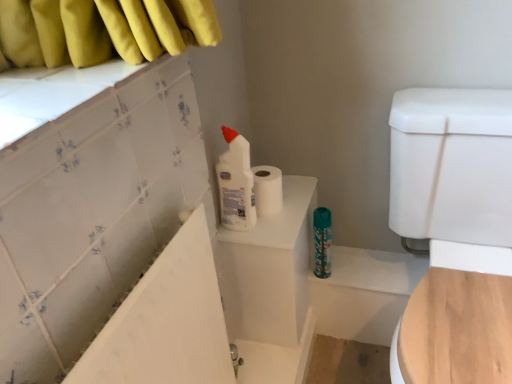
Question: Is white plastic bottle at upper center bigger or smaller than teal glossy water bottle at center?

Choices:
 (A) big
 (B) small

Answer: (A)

Question: Would you say white plastic bottle at upper center is inside or outside teal glossy water bottle at center?

Choices:
 (A) outside
 (B) inside

Answer: (A)

Question: Based on their relative distances, which object is farther from the white plastic bottle at upper center?

Choices:
 (A) white glossy toilet bowl at right
 (B) white glossy bathtub at upper left
 (C) teal glossy water bottle at center
 (D) white matte toilet paper at upper center

Answer: (A)

Question: Which of these objects is positioned closest to the white glossy toilet bowl at right?

Choices:
 (A) teal glossy water bottle at center
 (B) white glossy bathtub at upper left
 (C) white matte toilet paper at upper center
 (D) white plastic bottle at upper center

Answer: (A)